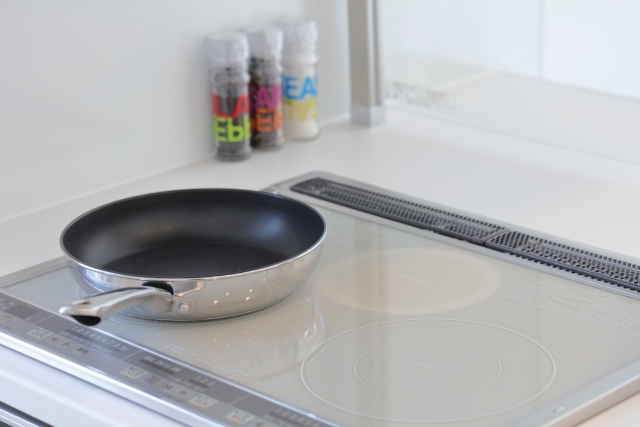
I want to click on seasoning container, so click(x=232, y=123), click(x=266, y=97), click(x=304, y=94).